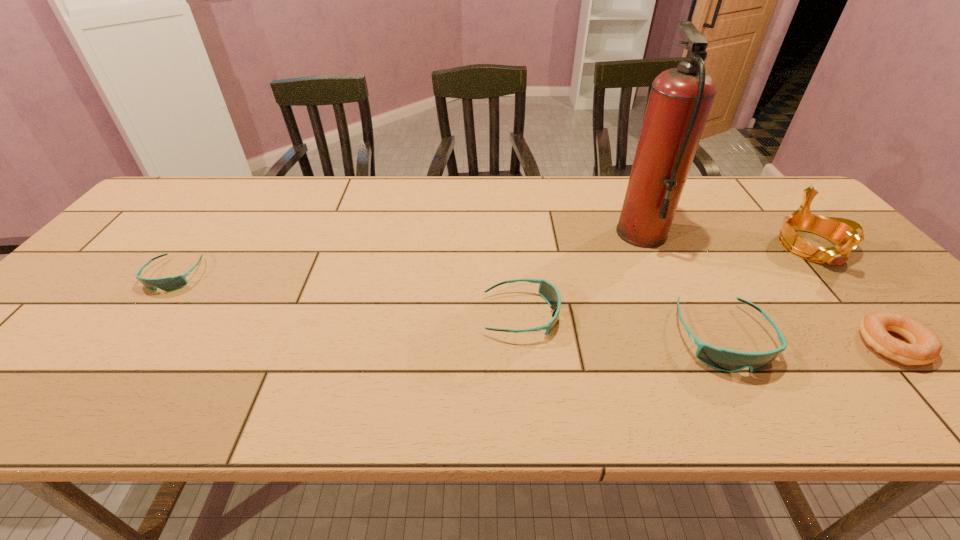
You are a GUI agent. You are given a task and a screenshot of the screen. Output one action in this format:
    pyautogui.click(x=<x>, y=<y>)
    Task: Click on the shortest sunglasses
    The height and width of the screenshot is (540, 960).
    Given the screenshot: What is the action you would take?
    pyautogui.click(x=167, y=284)

Where is `the leftmost object`? The width and height of the screenshot is (960, 540). the leftmost object is located at coordinates (167, 284).

This screenshot has width=960, height=540. Find the location of `the second object from left to right`. the second object from left to right is located at coordinates (547, 290).

The width and height of the screenshot is (960, 540). I want to click on the second tallest sunglasses, so click(547, 290).

You are a GUI agent. You are given a task and a screenshot of the screen. Output one action in this format:
    pyautogui.click(x=<x>, y=<y>)
    Task: Click on the fourth shortest object
    Image resolution: width=960 pixels, height=540 pixels.
    Given the screenshot: What is the action you would take?
    pyautogui.click(x=723, y=359)

This screenshot has width=960, height=540. In order to click on the rightmost sunglasses in this screenshot , I will do `click(723, 359)`.

Image resolution: width=960 pixels, height=540 pixels. I want to click on tiara, so click(x=846, y=234).

Identify the location of fire extinguisher. (680, 100).

Locate an element on the screen. bagel is located at coordinates (925, 346).

Where is `blank area located on the front-facing side of the leftmost object`? blank area located on the front-facing side of the leftmost object is located at coordinates (146, 312).